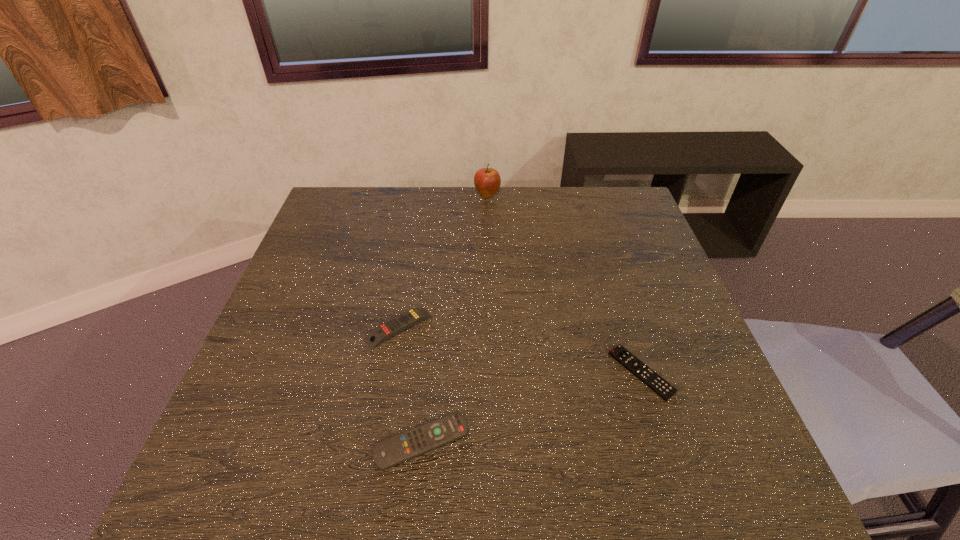
You are a GUI agent. You are given a task and a screenshot of the screen. Output one action in this format:
    pyautogui.click(x=<x>, y=<y>)
    Task: Click on the vacant space located 0.150m on the left of the shortest remote control
    The image size is (960, 540).
    Given the screenshot: What is the action you would take?
    pyautogui.click(x=543, y=372)

This screenshot has width=960, height=540. Identify the location of object that is at the far edge. (487, 181).

Locate an element on the screen. The width and height of the screenshot is (960, 540). object at the near edge is located at coordinates (392, 451).

Image resolution: width=960 pixels, height=540 pixels. Find the location of `object that is positioned at the right edge`. object that is positioned at the right edge is located at coordinates (660, 386).

At what (x,y) coordinates should I click in order to perform the action: click on vacant space at the far edge of the desktop. Please return your answer as a coordinate pair (x, y). Looking at the image, I should click on (434, 218).

Find the location of a particular element. The width and height of the screenshot is (960, 540). free location at the near edge is located at coordinates (326, 461).

In the image, there is a desktop. At what (x,y) coordinates should I click in order to perform the action: click on vacant space at the left edge. Please return your answer as a coordinate pair (x, y). Looking at the image, I should click on (333, 338).

Identify the location of blank space at the right edge. Image resolution: width=960 pixels, height=540 pixels. (685, 352).

Where is `vacant space at the far left corner of the desktop`? vacant space at the far left corner of the desktop is located at coordinates (320, 227).

I want to click on unoccupied position between the apple and the nearest object, so click(454, 318).